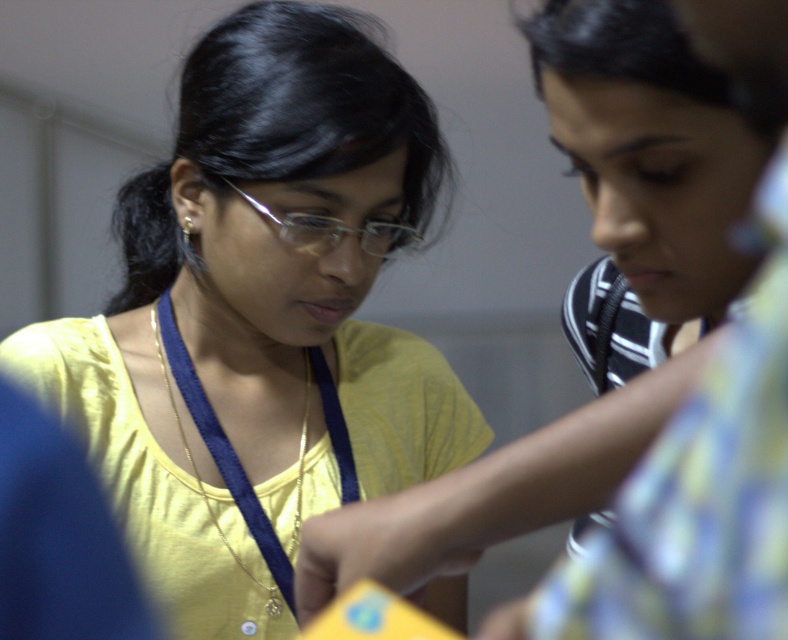
Question: Can you confirm if yellow matte shirt at center is wider than clear plastic glasses at center?

Choices:
 (A) yes
 (B) no

Answer: (A)

Question: Which point is farther from the camera taking this photo?

Choices:
 (A) (272, 221)
 (B) (779, 26)
 (C) (158, 253)
 (D) (169, 305)

Answer: (C)

Question: Which object appears farthest from the camera in this image?

Choices:
 (A) yellow matte shirt at center
 (B) blue fabric at center
 (C) yellow fabric shirt at upper left

Answer: (B)

Question: Is yellow fabric shirt at upper left to the right of clear plastic glasses at center from the viewer's perspective?

Choices:
 (A) no
 (B) yes

Answer: (B)

Question: Does yellow matte shirt at center appear over blue fabric at center?

Choices:
 (A) no
 (B) yes

Answer: (B)

Question: Which point is closer to the camera?

Choices:
 (A) clear plastic glasses at center
 (B) yellow matte shirt at center
 (C) yellow fabric shirt at upper left

Answer: (C)